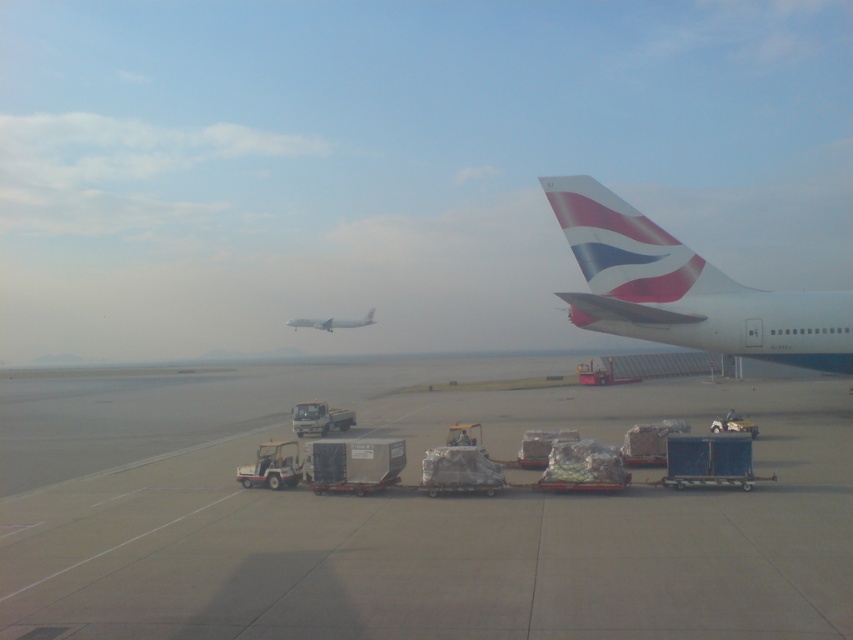
You are a ground crew member tasked with directing aircraft. You need to determine which airplane is smaller between the polished aluminum airplane at right and the white matte airplane at center. Which one should you identify as the smaller one?

The polished aluminum airplane at right has a smaller size compared to the white matte airplane at center, so you should identify the polished aluminum airplane at right as the smaller one.

From the picture: What is the 2D coordinate of the smooth concrete tarmac at center in the image?

The smooth concrete tarmac at center is located at the 2D coordinate point of (408, 515).